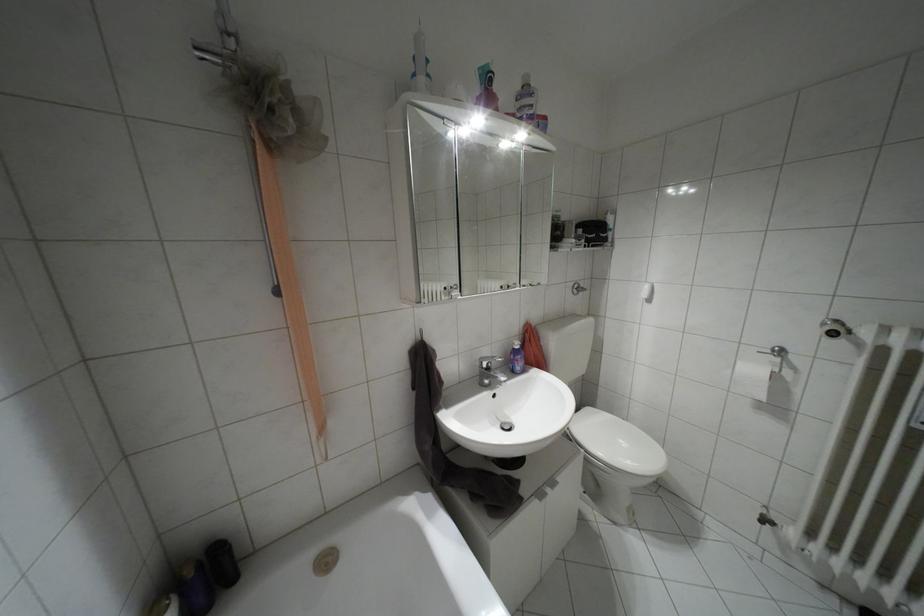
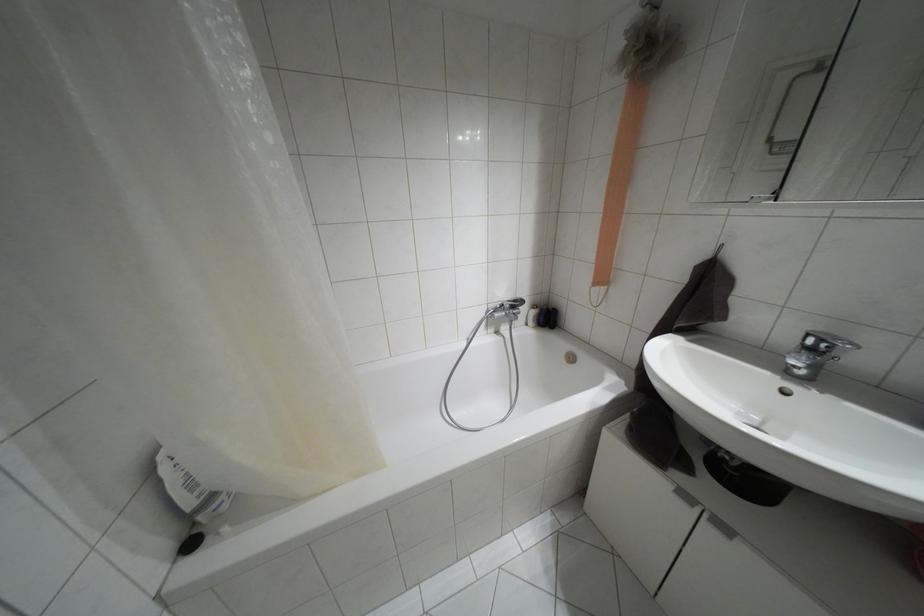
Locate, in the second image, the point that corresponds to (552,482) in the first image.

(723, 528)